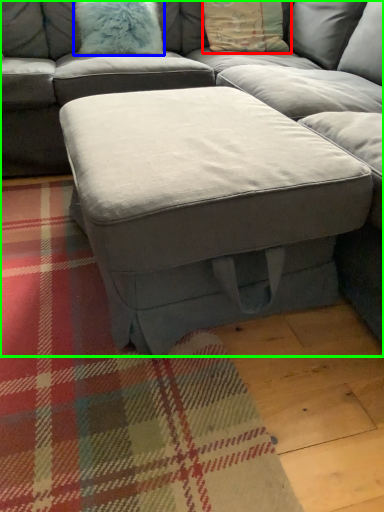
Question: Estimate the real-world distances between objects in this image. Which object is farther from pillow (highlighted by a red box), pillow (highlighted by a blue box) or studio couch (highlighted by a green box)?

Choices:
 (A) pillow
 (B) studio couch

Answer: (B)